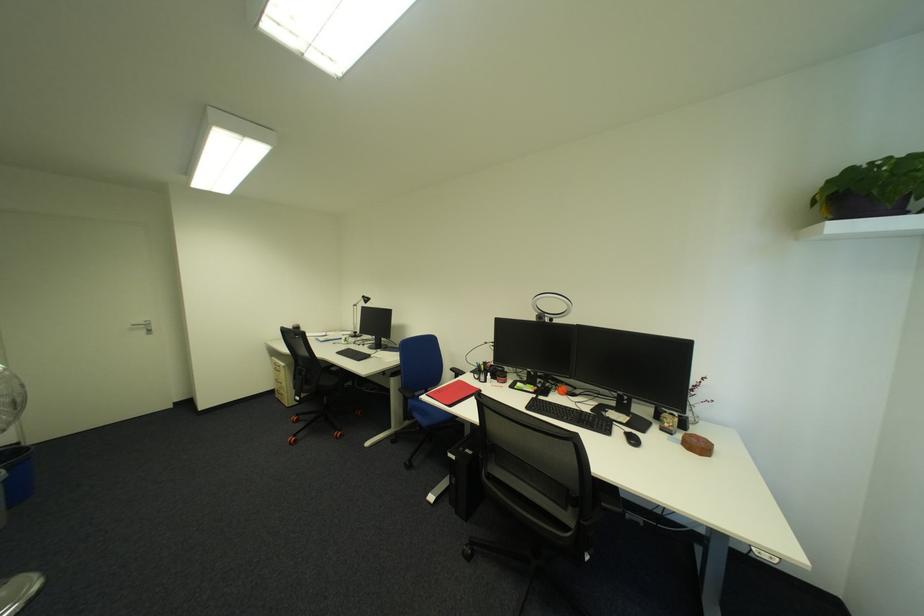
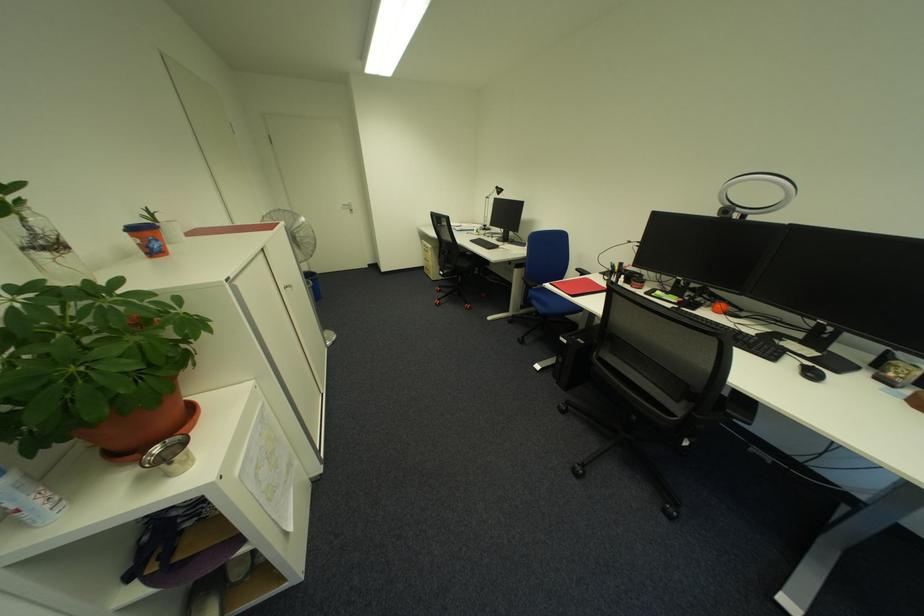
In the second image, find the point that corresponds to [420,403] in the first image.

(541, 293)